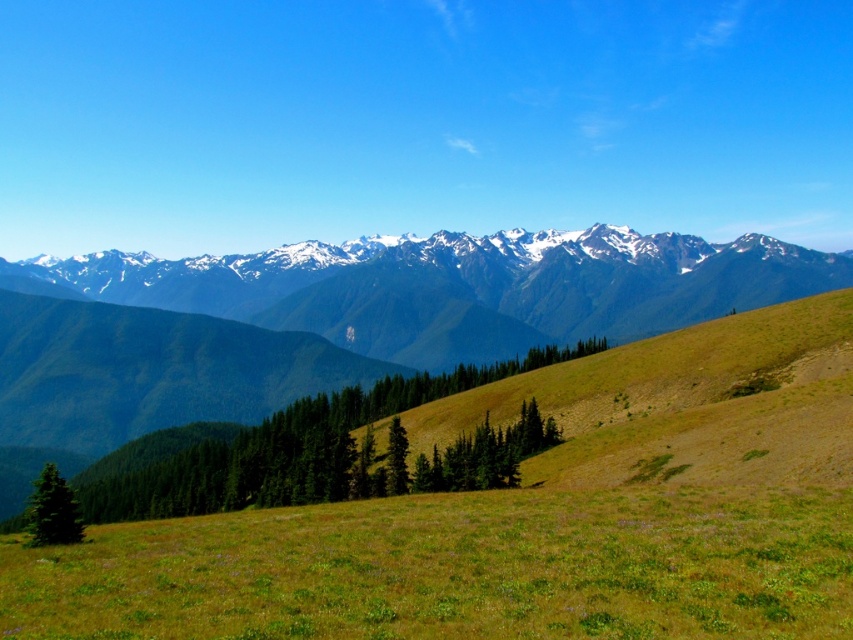
Question: Where is green textured trees at center located in relation to green matte tree at lower left in the image?

Choices:
 (A) above
 (B) below

Answer: (A)

Question: Which object is closer to the camera taking this photo?

Choices:
 (A) green textured mountains at upper center
 (B) green textured trees at center

Answer: (B)

Question: Does green grassy field at lower center have a smaller size compared to green textured tree at center?

Choices:
 (A) yes
 (B) no

Answer: (B)

Question: In this image, where is green textured trees at center located relative to green textured tree at center?

Choices:
 (A) left
 (B) right

Answer: (A)

Question: Among these points, which one is nearest to the camera?

Choices:
 (A) (192, 506)
 (B) (822, 616)
 (C) (57, 541)
 (D) (393, 451)

Answer: (B)

Question: Based on their relative distances, which object is nearer to the green matte tree at lower left?

Choices:
 (A) green textured trees at center
 (B) green textured tree at center
 (C) green grassy field at lower center

Answer: (C)